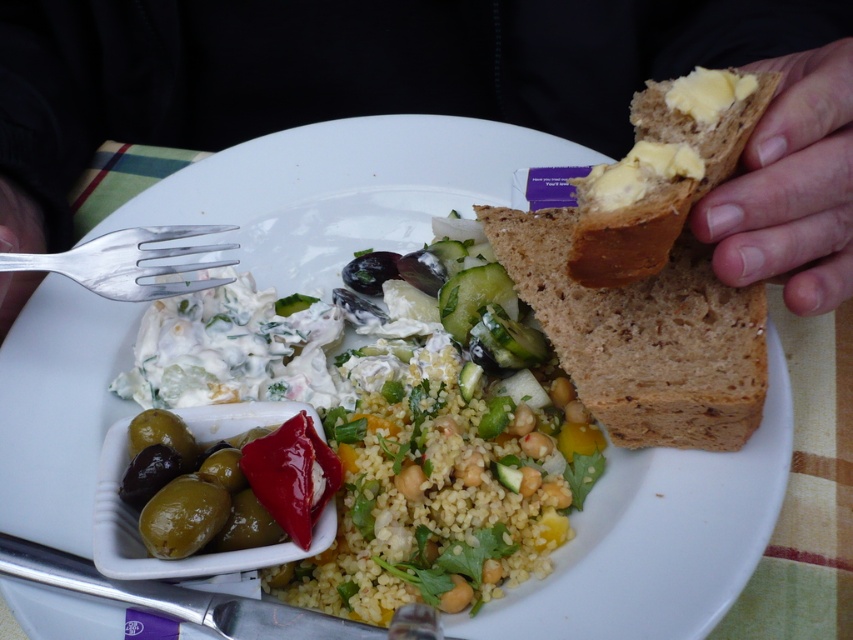
Question: Which point appears farthest from the camera in this image?

Choices:
 (A) (582, 195)
 (B) (514, 225)

Answer: (B)

Question: Is silver metallic fork at left positioned before green crisp pickle at center?

Choices:
 (A) yes
 (B) no

Answer: (A)

Question: Is buttery brown bread at upper right to the right of silver metallic fork at left from the viewer's perspective?

Choices:
 (A) yes
 (B) no

Answer: (A)

Question: Considering the real-world distances, which object is closest to the brown bread at right?

Choices:
 (A) brown matte bread at right
 (B) yellow creamy cheese at upper right
 (C) silver metallic fork at left

Answer: (C)

Question: Does brown matte bread at right have a larger size compared to buttery brown bread at upper right?

Choices:
 (A) yes
 (B) no

Answer: (A)

Question: Which object is positioned closest to the silver metallic fork at left?

Choices:
 (A) brown bread at right
 (B) brown textured bread at right

Answer: (A)